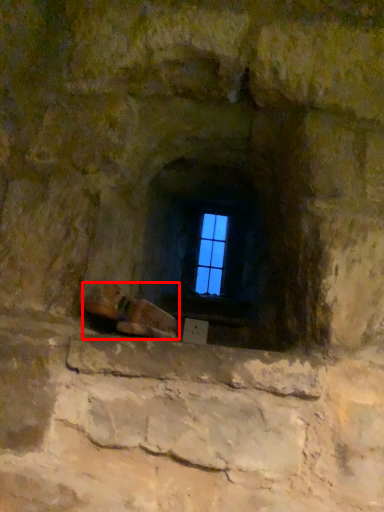
Question: From the image's perspective, what is the correct spatial relationship of footwear (annotated by the red box) in relation to window?

Choices:
 (A) below
 (B) above

Answer: (A)